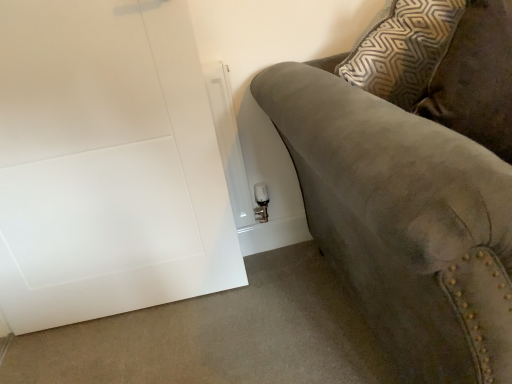
Locate an element on the screen. The image size is (512, 384). white matte door at lower left is located at coordinates (106, 163).

What do you see at coordinates (106, 163) in the screenshot? This screenshot has height=384, width=512. I see `white matte door at lower left` at bounding box center [106, 163].

Find the location of a particular element. suede couch at right is located at coordinates (414, 179).

What is the approximate width of suede couch at right?

suede couch at right is 1.09 meters in width.

Image resolution: width=512 pixels, height=384 pixels. What do you see at coordinates (414, 179) in the screenshot?
I see `suede couch at right` at bounding box center [414, 179].

This screenshot has height=384, width=512. I want to click on white matte door at lower left, so click(x=106, y=163).

Is white matte door at lower left at the left side of suede couch at right?

Correct, you'll find white matte door at lower left to the left of suede couch at right.

Considering the relative positions of white matte door at lower left and suede couch at right in the image provided, is white matte door at lower left in front of suede couch at right?

No, it is not.

Is point (88, 191) less distant than point (458, 48)?

No, it is not.

From the image's perspective, which is above, white matte door at lower left or suede couch at right?

white matte door at lower left, from the image's perspective.

From a real-world perspective, which is physically above, white matte door at lower left or suede couch at right?

white matte door at lower left.

Considering the sizes of white matte door at lower left and suede couch at right in the image, is white matte door at lower left wider or thinner than suede couch at right?

Clearly, white matte door at lower left has less width compared to suede couch at right.

Does white matte door at lower left have a lesser height compared to suede couch at right?

No.

In the scene shown: Considering the sizes of objects white matte door at lower left and suede couch at right in the image provided, who is smaller, white matte door at lower left or suede couch at right?

With smaller size is white matte door at lower left.

Could suede couch at right be considered to be inside white matte door at lower left?

No, white matte door at lower left does not contain suede couch at right.

Based on the photo, is white matte door at lower left far from suede couch at right?

white matte door at lower left is actually quite close to suede couch at right.

Is white matte door at lower left oriented away from suede couch at right?

No, white matte door at lower left's orientation is not away from suede couch at right.

Can you tell me how much white matte door at lower left and suede couch at right differ in facing direction?

The angular difference between white matte door at lower left and suede couch at right is 3.83 degrees.

How much distance is there between white matte door at lower left and suede couch at right?

They are 59.44 centimeters apart.

Identify the location of door that appears above the suede couch at right (from a real-world perspective). This screenshot has height=384, width=512. (106, 163).

Would you say suede couch at right is to the left or to the right of white matte door at lower left in the picture?

suede couch at right is positioned on white matte door at lower left's right side.

From the picture: Which object is further away from the camera, suede couch at right or white matte door at lower left?

white matte door at lower left is behind.

Considering the points (428, 296) and (153, 58), which point is in front, point (428, 296) or point (153, 58)?

The point (428, 296) is more forward.

From the image's perspective, is suede couch at right located above or below white matte door at lower left?

Based on their image positions, suede couch at right is located beneath white matte door at lower left.

From a real-world perspective, is suede couch at right physically above white matte door at lower left?

No, from a real-world perspective, suede couch at right is not over white matte door at lower left

Does suede couch at right have a lesser width compared to white matte door at lower left?

No, suede couch at right is not thinner than white matte door at lower left.

Can you confirm if suede couch at right is taller than white matte door at lower left?

No, suede couch at right is not taller than white matte door at lower left.

Is suede couch at right smaller than white matte door at lower left?

No, suede couch at right is not smaller than white matte door at lower left.

Choose the correct answer: Is suede couch at right inside white matte door at lower left or outside it?

suede couch at right exists outside the volume of white matte door at lower left.

Is suede couch at right with white matte door at lower left?

No, suede couch at right is not making contact with white matte door at lower left.

Is suede couch at right aimed at white matte door at lower left?

No, suede couch at right is not aimed at white matte door at lower left.

How many degrees apart are the facing directions of suede couch at right and white matte door at lower left?

The angle between the facing direction of suede couch at right and the facing direction of white matte door at lower left is 3.83 degrees.

Measure the distance from suede couch at right to white matte door at lower left.

23.40 inches.

What are the coordinates of `studio couch below the white matte door at lower left (from the image's perspective)` in the screenshot? It's located at (414, 179).

Where is `studio couch below the white matte door at lower left (from a real-world perspective)`? studio couch below the white matte door at lower left (from a real-world perspective) is located at coordinates (414, 179).

This screenshot has width=512, height=384. I want to click on studio couch below the white matte door at lower left (from the image's perspective), so click(x=414, y=179).